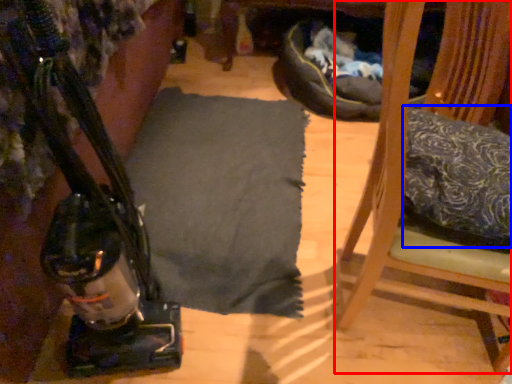
Question: Among these objects, which one is nearest to the camera, furniture (highlighted by a red box) or pillow (highlighted by a blue box)?

Choices:
 (A) furniture
 (B) pillow

Answer: (A)